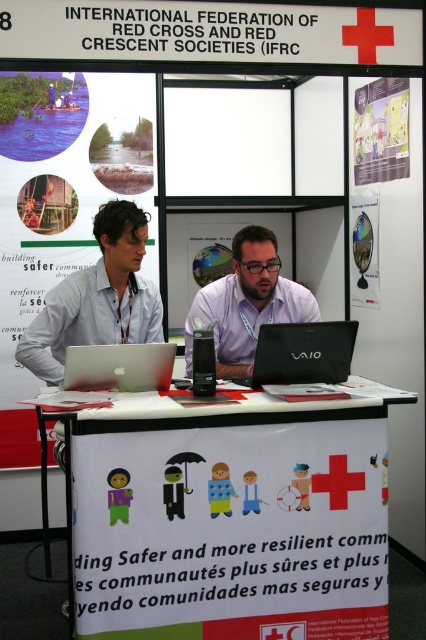
You are a photographer at the conference and want to capture a photo of the matte purple shirt at center and the matte paper poster at upper right. Which object should you zoom in on to ensure both fit in the frame without cropping?

The matte paper poster at upper right is smaller in width than the matte purple shirt at center, so you should zoom in on the matte paper poster at upper right to ensure both fit in the frame without cropping.

Looking at this image, you are a volunteer at the IFRC booth and need to hand a document to the person at the matte silver laptop at center. The document is on the white paper at upper left. Can you reach it without moving from your current position if your arm can extend 1 meter?

The distance between the white paper at upper left and the matte silver laptop at center is 1.23 meters. Since your arm can only extend 1 meter, you cannot reach the document without moving.

You are a photographer at the conference and want to capture a photo of the black matte laptop at center without including the matte purple shirt at center in the frame. Is this possible given their positions?

The matte purple shirt at center is above the black matte laptop at center, so it would block the view. Therefore, it is not possible to capture the black matte laptop at center without including the matte purple shirt at center in the frame.